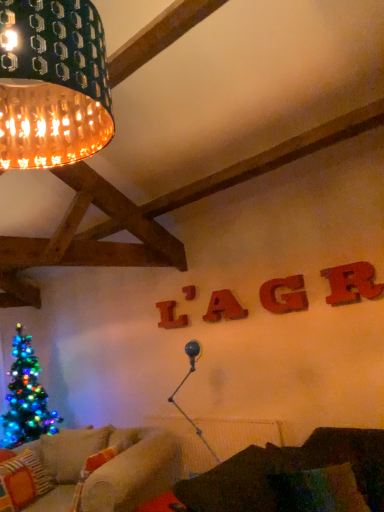
Question: Does point (294, 278) appear closer or farther from the camera than point (170, 321)?

Choices:
 (A) closer
 (B) farther

Answer: (A)

Question: In the image, is velvet red letter g at center, arranged as the 2th letter when viewed from the front, positioned in front of or behind wooden letter at center, the 1th letter viewed from the left?

Choices:
 (A) behind
 (B) front

Answer: (B)

Question: Which is farther from the matte gold lampshade at upper left?

Choices:
 (A) velvet red letter g at center, arranged as the 2th letter when viewed from the front
 (B) knitted wool pillow at lower left
 (C) wooden letter at center, the fifth letter viewed from the front
 (D) wooden letter at upper center, placed as the 3th letter when sorted from right to left
 (E) velvet dark brown couch at lower right

Answer: (B)

Question: Estimate the real-world distances between objects in this image. Which object is closer to the wooden letter at upper right, positioned as the fifth letter in left-to-right order?

Choices:
 (A) wooden letter at upper center, which appears as the 2th letter when viewed from the back
 (B) wooden letter at center, the 1th letter viewed from the back
 (C) matte gold lampshade at upper left
 (D) velvet dark brown couch at lower right
 (E) velvet red letter g at center, positioned as the 4th letter in left-to-right order

Answer: (E)